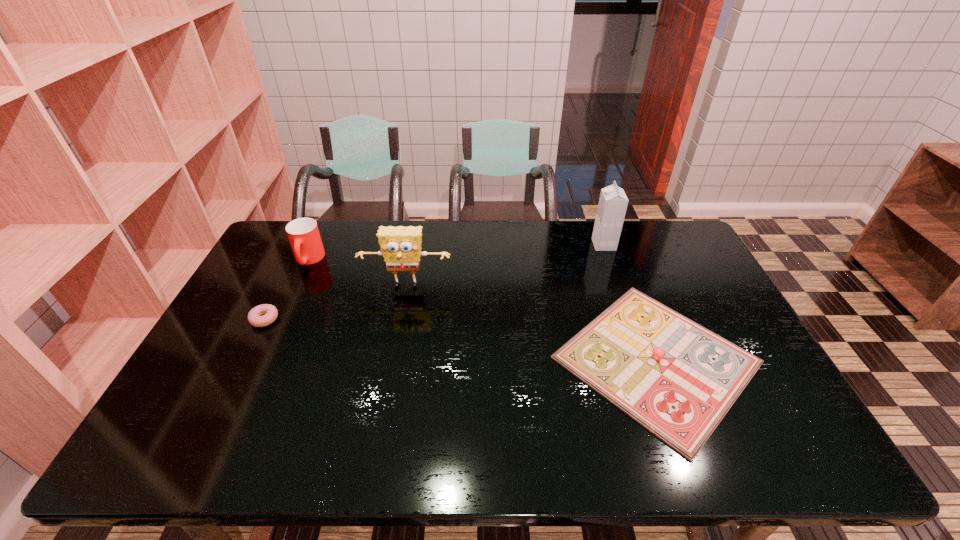
This screenshot has height=540, width=960. Find the location of `free region located 0.240m on the left of the gameboard`. free region located 0.240m on the left of the gameboard is located at coordinates (463, 360).

Identify the location of vacant area located on the right of the doughnut. This screenshot has height=540, width=960. (349, 319).

Where is `carton that is at the far edge`? The height and width of the screenshot is (540, 960). carton that is at the far edge is located at coordinates (612, 206).

Locate an element on the screen. cup present at the far edge is located at coordinates point(303,233).

At what (x,y) coordinates should I click in order to perform the action: click on object located at the near edge. Please return your answer as a coordinate pair (x, y). This screenshot has height=540, width=960. Looking at the image, I should click on (677, 379).

You are a GUI agent. You are given a task and a screenshot of the screen. Output one action in this format:
    pyautogui.click(x=<x>, y=<y>)
    Task: Click on the cup that is positioned at the left edge
    
    Given the screenshot: What is the action you would take?
    pyautogui.click(x=303, y=233)

You are a GUI agent. You are given a task and a screenshot of the screen. Output one action in this format:
    pyautogui.click(x=<x>, y=<y>)
    Task: Click on the doughnut that is at the left edge
    This screenshot has height=540, width=960.
    Given the screenshot: What is the action you would take?
    pyautogui.click(x=269, y=312)

Locate an element on the screen. object that is at the right edge is located at coordinates (677, 379).

Locate an element on the screen. object present at the far left corner is located at coordinates (303, 233).

You are a GUI agent. You are given a task and a screenshot of the screen. Output one action in this format:
    pyautogui.click(x=<x>, y=<y>)
    Task: Click on the object located in the near right corner section of the desktop
    
    Given the screenshot: What is the action you would take?
    pyautogui.click(x=677, y=379)